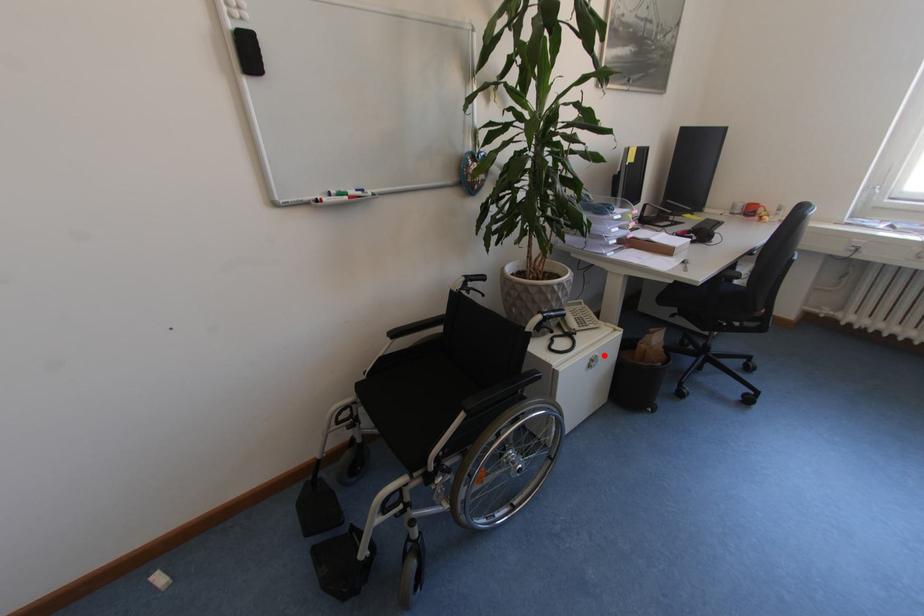
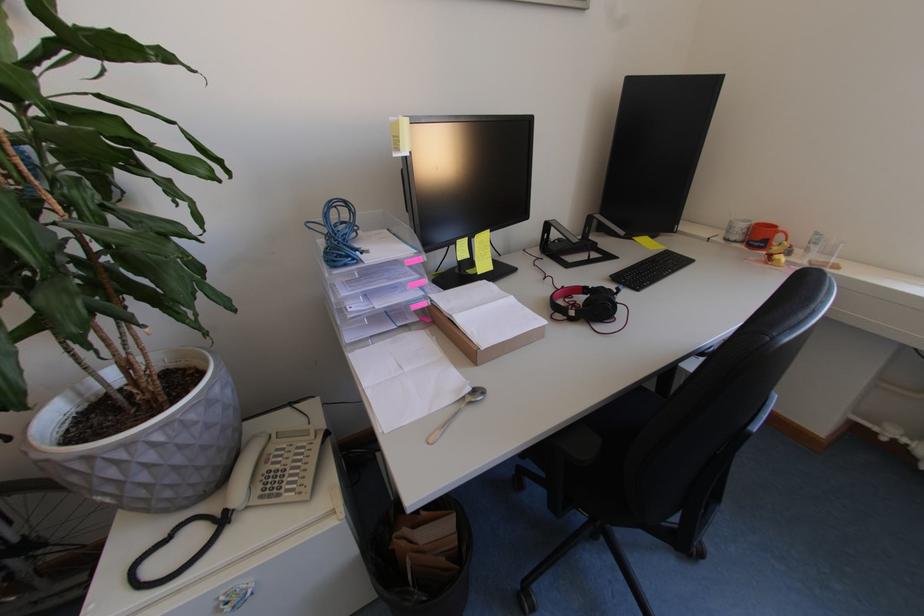
Find the pixel in the second image that matches the highlighted location in the first image.

(251, 585)